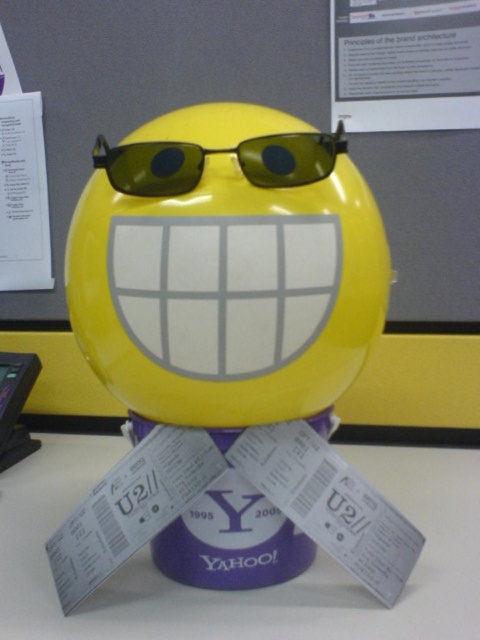
What are the coordinates of the yellow glossy ball at center in the image?

The coordinates of the yellow glossy ball at center are at point (227, 269).

You have a small box that is 10 cm wide. You want to place either the green plastic sunglasses at center or the black plastic phone at lower left inside it. Which item can fit into the box based on their widths?

The black plastic phone at lower left can fit into the box since it is narrower than the green plastic sunglasses at center, which might not fit due to its wider width.